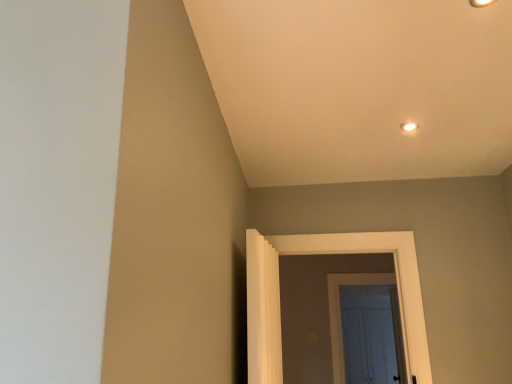
Question: Considering the positions of white wooden door at center, arranged as the 2th door when viewed from the left, and white painted wood door at center, which is counted as the second door, starting from the back, in the image, is white wooden door at center, arranged as the 2th door when viewed from the left, bigger or smaller than white painted wood door at center, which is counted as the second door, starting from the back,?

Choices:
 (A) big
 (B) small

Answer: (B)

Question: Is white wooden door at center, arranged as the 2th door when viewed from the left, taller or shorter than white painted wood door at center, which is the 2th door in right-to-left order?

Choices:
 (A) tall
 (B) short

Answer: (A)

Question: Which is farther from the white wooden door at center, arranged as the 2th door when viewed from the left?

Choices:
 (A) white painted wood door at center, which is counted as the second door, starting from the back
 (B) white glossy light fixture at upper center, which ranks as the first light fixture in bottom-to-top order
 (C) matte gold light fixture at upper right, which is counted as the second light fixture, starting from the bottom

Answer: (C)

Question: Considering the real-world distances, which object is farthest from the white painted wood door at center, arranged as the first door when viewed from the front?

Choices:
 (A) white glossy light fixture at upper center, which ranks as the first light fixture in bottom-to-top order
 (B) white wooden door at center, marked as the 1th door in a back-to-front arrangement
 (C) matte gold light fixture at upper right, the 1th light fixture viewed from the front

Answer: (C)